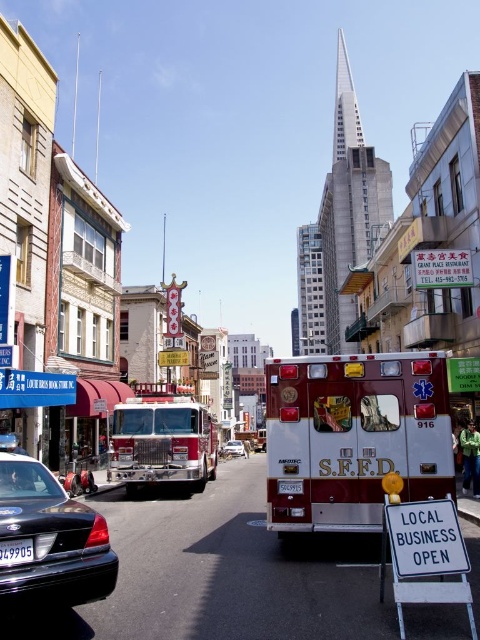
Does white plastic license plate at center have a smaller size compared to metallic silver car at center?

Yes, white plastic license plate at center is smaller than metallic silver car at center.

Who is more forward, (19, 541) or (235, 442)?

Point (19, 541) is in front.

You are a GUI agent. You are given a task and a screenshot of the screen. Output one action in this format:
    pyautogui.click(x=<x>, y=<y>)
    Task: Click on the white plastic license plate at center
    
    Given the screenshot: What is the action you would take?
    pyautogui.click(x=15, y=552)

Which is below, black glossy sedan at lower left or white plastic license plate at center?

white plastic license plate at center is below.

Does black glossy sedan at lower left have a lesser width compared to white plastic license plate at center?

In fact, black glossy sedan at lower left might be wider than white plastic license plate at center.

The width and height of the screenshot is (480, 640). Find the location of `black glossy sedan at lower left`. black glossy sedan at lower left is located at coordinates (50, 540).

Is point (436, 356) positioned in front of point (229, 442)?

Yes, it is.

Image resolution: width=480 pixels, height=640 pixels. Identify the location of white glossy fire truck at center. (x=354, y=436).

Is point (409, 401) behind point (237, 440)?

No, (409, 401) is closer to viewer.

At what (x,y) coordinates should I click in order to perform the action: click on white glossy fire truck at center. Please return your answer as a coordinate pair (x, y). This screenshot has width=480, height=640. Looking at the image, I should click on (354, 436).